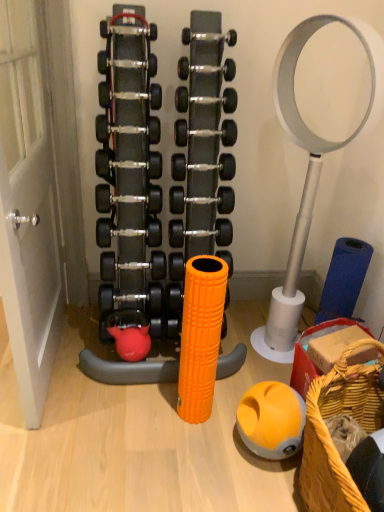
Question: Does black rubber dumbbell at center, the 6th dumbbell viewed from the top, turn towards white matte door at left?

Choices:
 (A) yes
 (B) no

Answer: (B)

Question: Is black rubber dumbbell at center, the 6th dumbbell viewed from the top, facing away from white matte door at left?

Choices:
 (A) no
 (B) yes

Answer: (A)

Question: From the image's perspective, does black rubber dumbbell at center, which is counted as the fourth dumbbell, starting from the bottom, appear lower than white matte door at left?

Choices:
 (A) no
 (B) yes

Answer: (A)

Question: Is white matte door at left completely or partially inside black rubber dumbbell at center, which is counted as the fourth dumbbell, starting from the bottom?

Choices:
 (A) yes
 (B) no

Answer: (B)

Question: Are black rubber dumbbell at center, the 6th dumbbell viewed from the top, and white matte door at left making contact?

Choices:
 (A) no
 (B) yes

Answer: (A)

Question: From a real-world perspective, is black rubber dumbbell at center, the fifth dumbbell positioned from the bottom, positioned above or below white matte door at left?

Choices:
 (A) below
 (B) above

Answer: (B)

Question: From the image's perspective, relative to white matte door at left, is black rubber dumbbell at center, placed as the 5th dumbbell when sorted from top to bottom, above or below?

Choices:
 (A) above
 (B) below

Answer: (A)

Question: Is black rubber dumbbell at center, placed as the 5th dumbbell when sorted from top to bottom, spatially inside white matte door at left, or outside of it?

Choices:
 (A) inside
 (B) outside

Answer: (B)

Question: Is black rubber dumbbell at center, the fifth dumbbell positioned from the bottom, bigger or smaller than white matte door at left?

Choices:
 (A) big
 (B) small

Answer: (B)

Question: In terms of size, does black rubber dumbbell at center, the 6th dumbbell viewed from the top, appear bigger or smaller than orange textured foam roller at center?

Choices:
 (A) big
 (B) small

Answer: (B)

Question: From the image's perspective, relative to orange textured foam roller at center, is black rubber dumbbell at center, the 6th dumbbell viewed from the top, above or below?

Choices:
 (A) above
 (B) below

Answer: (A)

Question: Is black rubber dumbbell at center, the 6th dumbbell viewed from the top, situated inside orange textured foam roller at center or outside?

Choices:
 (A) inside
 (B) outside

Answer: (B)

Question: From a real-world perspective, is black rubber dumbbell at center, which is counted as the fourth dumbbell, starting from the bottom, physically located above or below orange textured foam roller at center?

Choices:
 (A) below
 (B) above

Answer: (B)

Question: Considering the positions of black rubber dumbbell at center, the fifth dumbbell positioned from the bottom, and black rubber dumbbell at center, arranged as the 3th dumbbell when ordered from the bottom, in the image, is black rubber dumbbell at center, the fifth dumbbell positioned from the bottom, bigger or smaller than black rubber dumbbell at center, arranged as the 3th dumbbell when ordered from the bottom,?

Choices:
 (A) big
 (B) small

Answer: (B)

Question: Is black rubber dumbbell at center, the fifth dumbbell positioned from the bottom, to the left or to the right of black rubber dumbbell at center, which ranks as the seventh dumbbell in top-to-bottom order, in the image?

Choices:
 (A) right
 (B) left

Answer: (A)